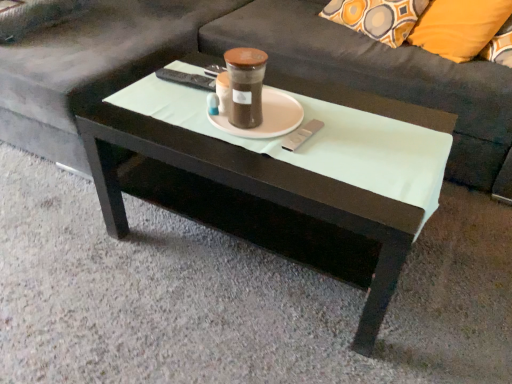
Image resolution: width=512 pixels, height=384 pixels. Identify the location of vacant space that is to the left of white matte saucer at center. (175, 114).